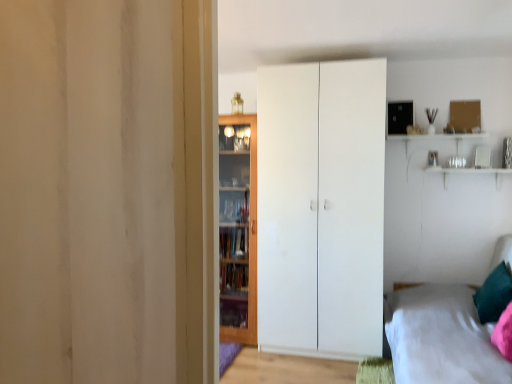
Question: In the image, is teal velvet pillow at lower right on the left side or the right side of white matte wardrobe at center?

Choices:
 (A) left
 (B) right

Answer: (B)

Question: From the image's perspective, is teal velvet pillow at lower right positioned above or below white matte wardrobe at center?

Choices:
 (A) below
 (B) above

Answer: (A)

Question: Which object is the closest to the teal velvet pillow at lower right?

Choices:
 (A) white fabric bed at lower right
 (B) white matte wardrobe at center
 (C) wooden cabinet at center

Answer: (A)

Question: Which object is the closest to the white fabric bed at lower right?

Choices:
 (A) teal velvet pillow at lower right
 (B) white matte wardrobe at center
 (C) wooden cabinet at center

Answer: (A)